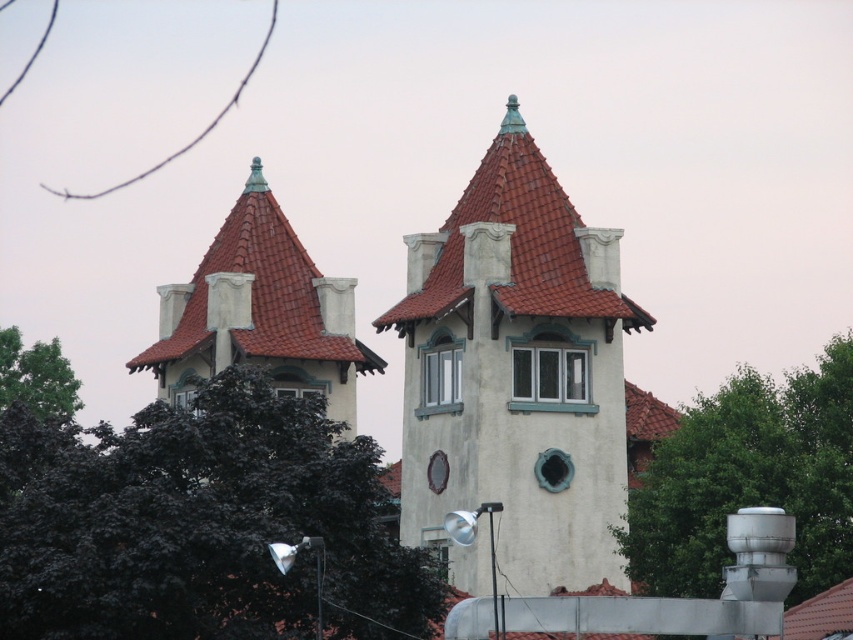
Looking at this image, you are standing in front of the two towers and want to take a photo that includes both the matte white tower at upper left and the green leafy tree at left. Based on their positions, which object should be positioned on the right side of the photo frame?

The matte white tower at upper left is to the right of the green leafy tree at left, so the matte white tower at upper left should be on the right side of the photo frame.

You are an architect designing a new garden layout. You need to place a bench so that it is equidistant from both the green leafy tree at left and the white painted wood window at center. Given the spatial relationship between these two objects, where should you position the bench?

The bench should be placed in a position equidistant from both the green leafy tree at left and the white painted wood window at center. Since the green leafy tree at left is larger in size than the white painted wood window at center, the bench should be positioned closer to the smaller object, the white painted wood window at center, to maintain equal distance from both.